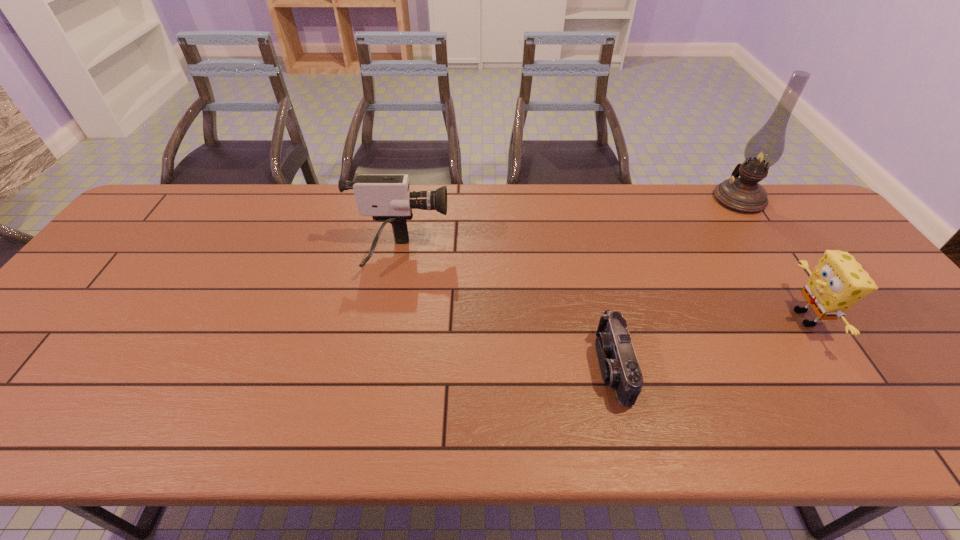
I want to click on free space between the third tallest object and the shorter camcorder, so tap(708, 342).

The image size is (960, 540). In order to click on vacant region between the third nearest object and the second shortest object in this screenshot , I will do click(603, 287).

Image resolution: width=960 pixels, height=540 pixels. I want to click on blank region between the oil lamp and the nearer camcorder, so click(676, 283).

Locate an element on the screen. This screenshot has width=960, height=540. vacant area that lies between the farthest object and the farther camcorder is located at coordinates (569, 227).

The height and width of the screenshot is (540, 960). In order to click on free space between the sponge and the shortest object in this screenshot , I will do `click(708, 342)`.

Identify which object is the third nearest to the shortest object. Please provide its 2D coordinates. Your answer should be formatted as a tuple, i.e. [(x, y)], where the tuple contains the x and y coordinates of a point satisfying the conditions above.

[(743, 194)]

Find the location of `object that stands as the second closest to the farther camcorder`. object that stands as the second closest to the farther camcorder is located at coordinates (838, 281).